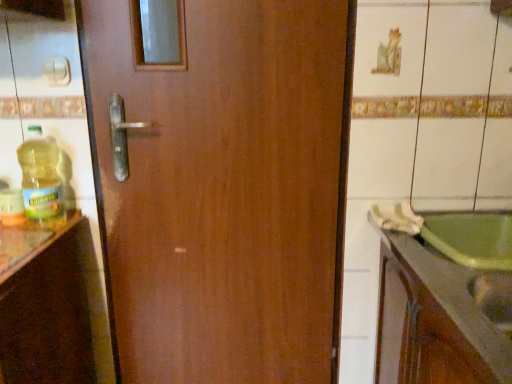
Question: Is the depth of green glossy sink at lower right less than that of translucent plastic bottle at left?

Choices:
 (A) yes
 (B) no

Answer: (A)

Question: Does green glossy sink at lower right have a larger size compared to translucent plastic bottle at left?

Choices:
 (A) no
 (B) yes

Answer: (B)

Question: From a real-world perspective, is green glossy sink at lower right located higher than translucent plastic bottle at left?

Choices:
 (A) no
 (B) yes

Answer: (A)

Question: Considering the relative sizes of green glossy sink at lower right and translucent plastic bottle at left in the image provided, is green glossy sink at lower right smaller than translucent plastic bottle at left?

Choices:
 (A) yes
 (B) no

Answer: (B)

Question: From the image's perspective, would you say green glossy sink at lower right is shown under translucent plastic bottle at left?

Choices:
 (A) yes
 (B) no

Answer: (A)

Question: Is green glossy sink at lower right to the right of translucent plastic bottle at left from the viewer's perspective?

Choices:
 (A) no
 (B) yes

Answer: (B)

Question: Considering the relative sizes of translucent plastic bottle at left and green glossy sink at lower right in the image provided, is translucent plastic bottle at left bigger than green glossy sink at lower right?

Choices:
 (A) yes
 (B) no

Answer: (B)

Question: Is translucent plastic bottle at left turned away from green glossy sink at lower right?

Choices:
 (A) no
 (B) yes

Answer: (A)

Question: Is translucent plastic bottle at left at the left side of green glossy sink at lower right?

Choices:
 (A) yes
 (B) no

Answer: (A)

Question: Does translucent plastic bottle at left come in front of green glossy sink at lower right?

Choices:
 (A) yes
 (B) no

Answer: (B)

Question: From the image's perspective, does translucent plastic bottle at left appear lower than green glossy sink at lower right?

Choices:
 (A) yes
 (B) no

Answer: (B)

Question: Considering the relative sizes of translucent plastic bottle at left and green glossy sink at lower right in the image provided, is translucent plastic bottle at left shorter than green glossy sink at lower right?

Choices:
 (A) no
 (B) yes

Answer: (A)

Question: Looking at their shapes, would you say green glossy sink at lower right is wider or thinner than translucent plastic bottle at left?

Choices:
 (A) thin
 (B) wide

Answer: (B)